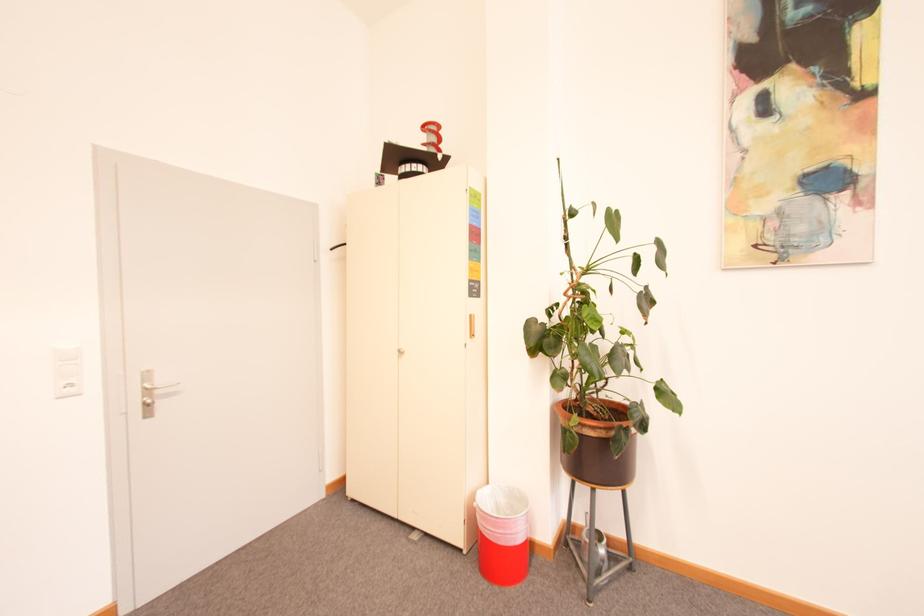
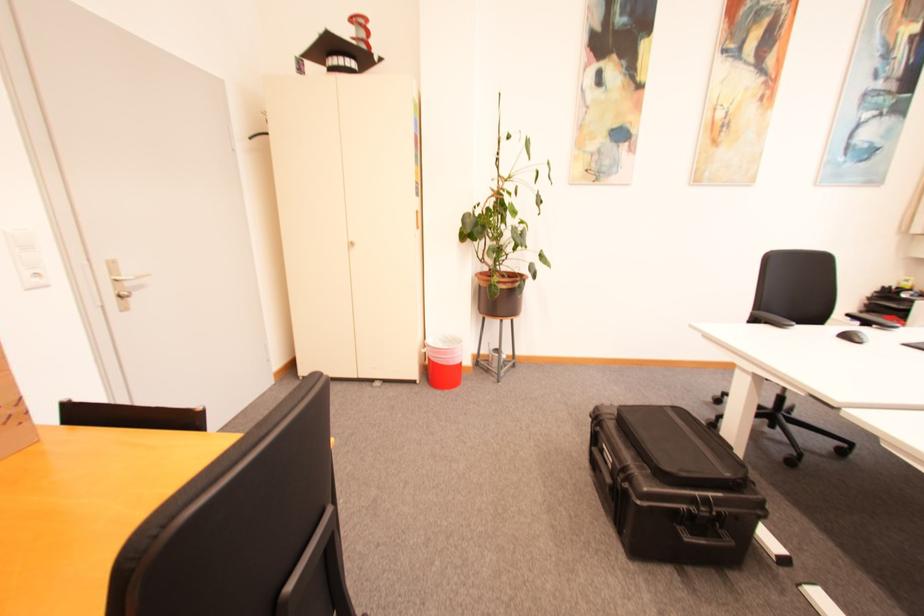
The point at (76,390) is marked in the first image. Where is the corresponding point in the second image?

(43, 281)